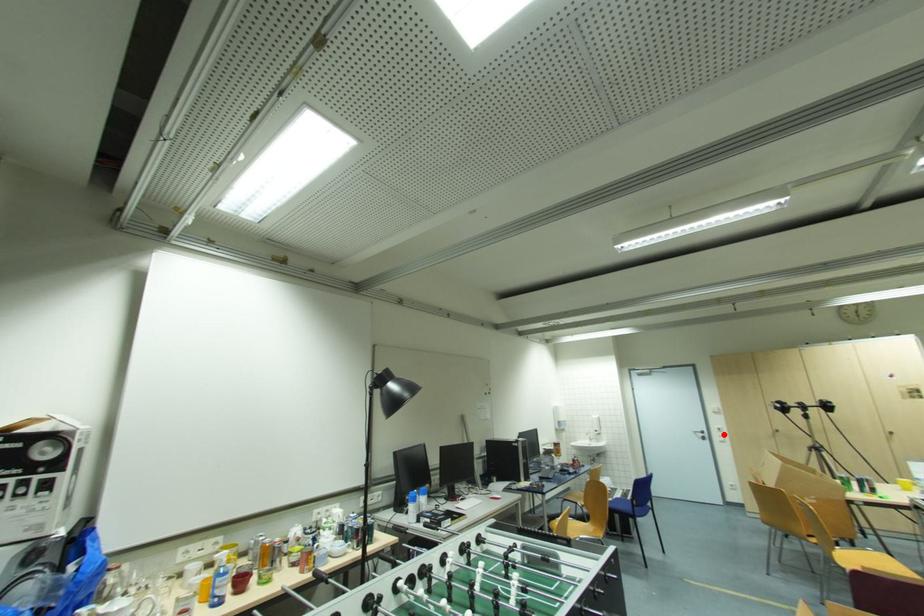
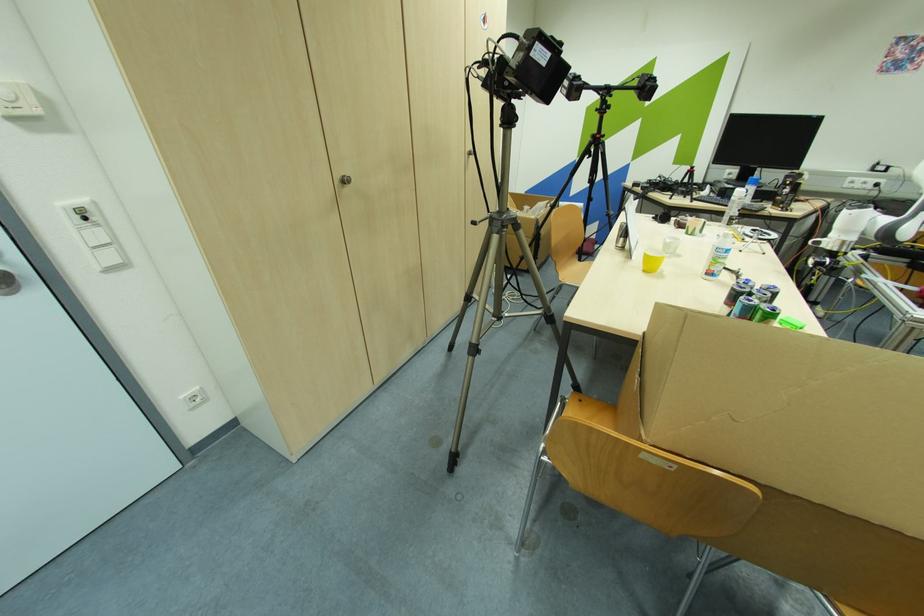
Locate, in the second image, the point that corresponds to the highlighted location in the first image.

(102, 236)